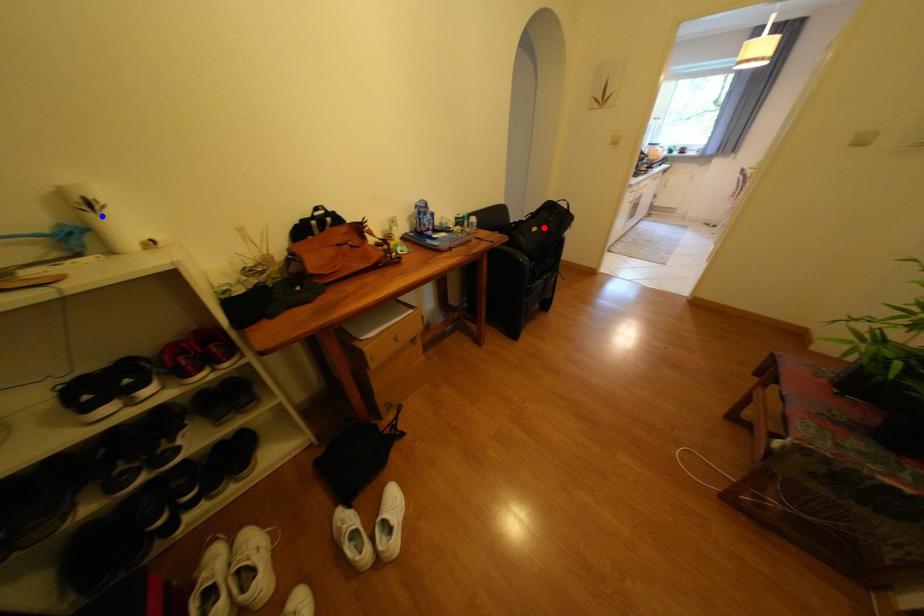
Question: Which of the two points in the image is closer to the camera?

Choices:
 (A) Blue point is closer.
 (B) Red point is closer.

Answer: (A)